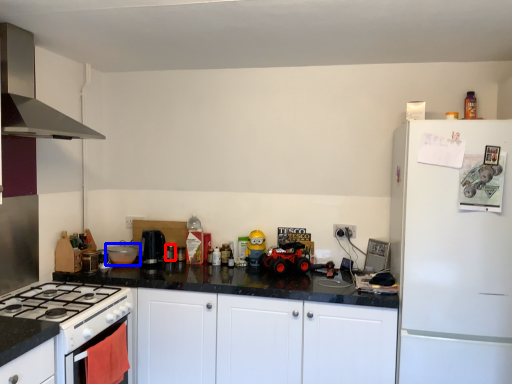
Question: Among these objects, which one is nearest to the camera, appliance (highlighted by a red box) or kitchen appliance (highlighted by a blue box)?

Choices:
 (A) appliance
 (B) kitchen appliance

Answer: (B)